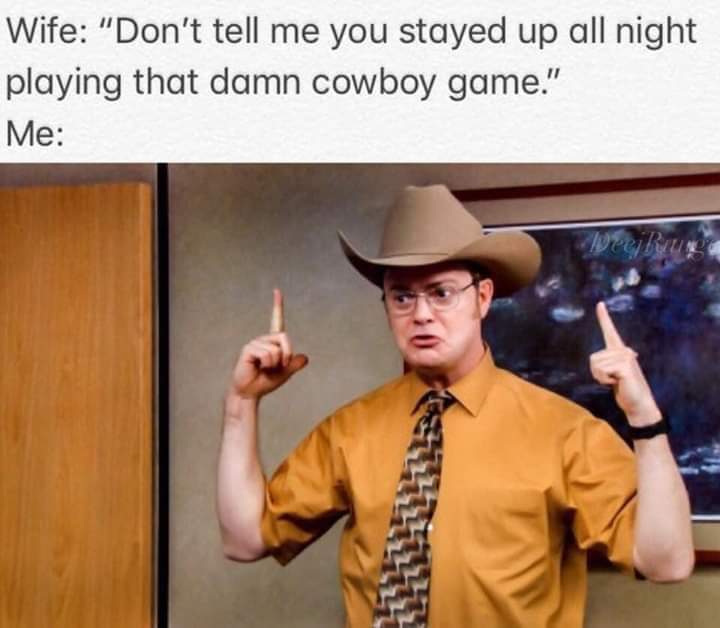
Identify the location of door. Image resolution: width=720 pixels, height=628 pixels. (81, 419).